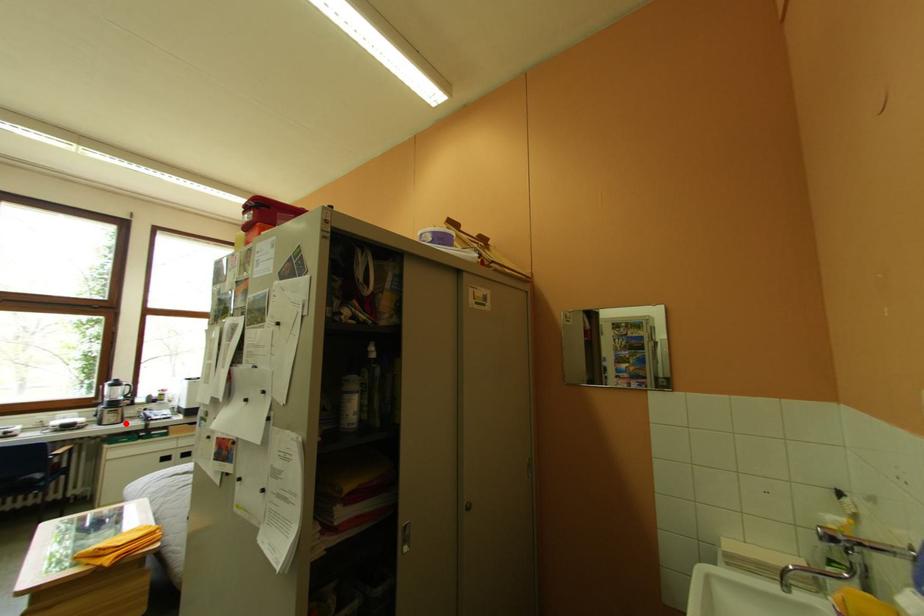
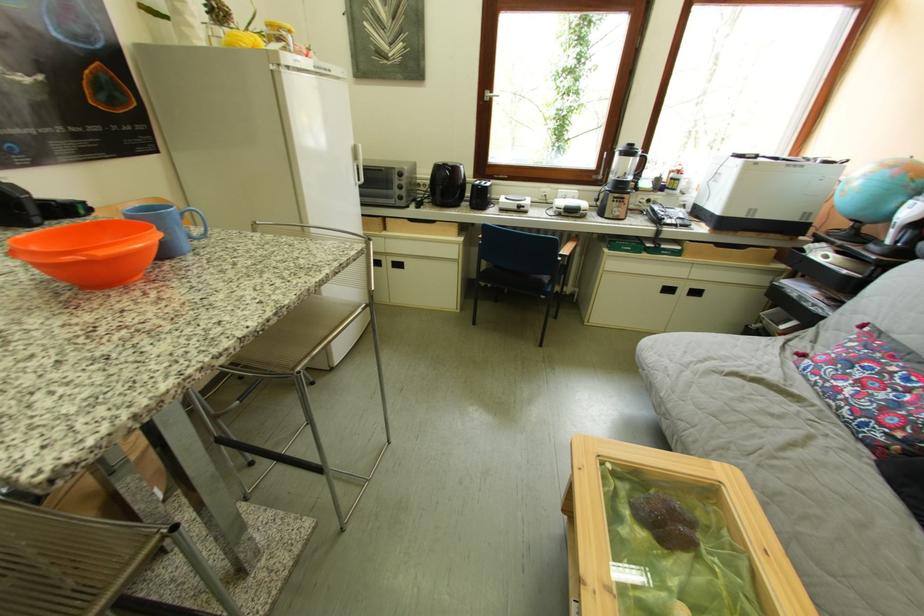
Question: I am providing you with two images of the same scene from different viewpoints. Given a red point in image1, look at the same physical point in image2. Is it:

Choices:
 (A) Closer to the viewpoint
 (B) Farther from the viewpoint

Answer: (B)